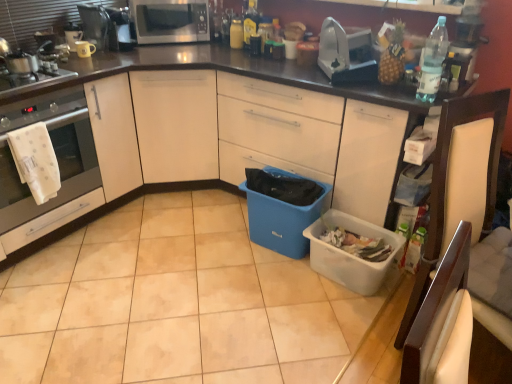
Where is `free space in front of yellow matte mug at upper left, which appears as the second appliance when viewed from the left`? The width and height of the screenshot is (512, 384). free space in front of yellow matte mug at upper left, which appears as the second appliance when viewed from the left is located at coordinates (71, 57).